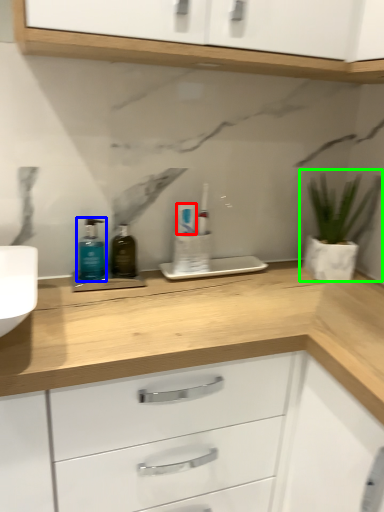
Question: Which object is the closest to the toothpaste (highlighted by a red box)? Choose among these: toiletry (highlighted by a blue box) or houseplant (highlighted by a green box).

Choices:
 (A) toiletry
 (B) houseplant

Answer: (A)